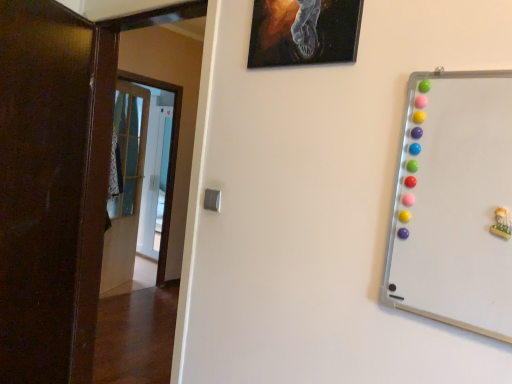
In order to face brown wooden door at left, which is the 2th door from front to back, should I rotate leftwards or rightwards?

It's best to rotate left around 16.453 degrees.

The height and width of the screenshot is (384, 512). Describe the element at coordinates (304, 32) in the screenshot. I see `black canvas painting at upper center` at that location.

The width and height of the screenshot is (512, 384). What do you see at coordinates (454, 203) in the screenshot?
I see `whiteboard at right` at bounding box center [454, 203].

The width and height of the screenshot is (512, 384). In order to click on dark wood door at left, which is counted as the first door, starting from the front in this screenshot , I will do `click(40, 184)`.

Image resolution: width=512 pixels, height=384 pixels. Describe the element at coordinates (125, 183) in the screenshot. I see `wooden door at left, the 1th door in the back-to-front sequence` at that location.

Where is `brown wooden door at left, which is the 2th door from front to back`? brown wooden door at left, which is the 2th door from front to back is located at coordinates (106, 158).

Are brown wooden door at left, which is the 2th door from front to back, and black canvas painting at upper center making contact?

There is a gap between brown wooden door at left, which is the 2th door from front to back, and black canvas painting at upper center.

Could you measure the distance between brown wooden door at left, acting as the 2th door starting from the back, and black canvas painting at upper center?

The distance of brown wooden door at left, acting as the 2th door starting from the back, from black canvas painting at upper center is 83.76 centimeters.

Is black canvas painting at upper center at the back of brown wooden door at left, which is the 2th door from front to back?

No, brown wooden door at left, which is the 2th door from front to back, is not facing the opposite direction of black canvas painting at upper center.

From a real-world perspective, is brown wooden door at left, which is the 2th door from front to back, on black canvas painting at upper center?

No, from a real-world perspective, brown wooden door at left, which is the 2th door from front to back, is not on top of black canvas painting at upper center.

How distant is black canvas painting at upper center from whiteboard at right?

18.38 inches.

Does point (302, 60) come farther from viewer compared to point (469, 144)?

Yes.

From the image's perspective, between black canvas painting at upper center and whiteboard at right, who is located below?

whiteboard at right.

Is black canvas painting at upper center positioned far away from whiteboard at right?

Actually, black canvas painting at upper center and whiteboard at right are a little close together.

How distant is whiteboard at right from transparent glass door at center?

3.58 meters.

Can you confirm if whiteboard at right is shorter than transparent glass door at center?

Indeed, whiteboard at right has a lesser height compared to transparent glass door at center.

Considering the positions of point (492, 92) and point (151, 158), is point (492, 92) closer or farther from the camera than point (151, 158)?

Clearly, point (492, 92) is closer to the camera than point (151, 158).

Based on the photo, from the image's perspective, which is above, whiteboard at right or transparent glass door at center?

transparent glass door at center.

Which of these two, brown wooden door at left, acting as the 2th door starting from the back, or transparent glass door at center, stands taller?

Standing taller between the two is brown wooden door at left, acting as the 2th door starting from the back.

Is brown wooden door at left, which is the 2th door from front to back, far from transparent glass door at center?

Absolutely, brown wooden door at left, which is the 2th door from front to back, is distant from transparent glass door at center.

Is brown wooden door at left, which is the 2th door from front to back, in front of transparent glass door at center?

Yes, it is in front of transparent glass door at center.

From the image's perspective, is brown wooden door at left, which is the 2th door from front to back, on transparent glass door at center?

No, from the image's perspective, brown wooden door at left, which is the 2th door from front to back, is not on top of transparent glass door at center.

From a real-world perspective, which object stands above the other?

From a 3D spatial view, dark wood door at left, which is counted as the first door, starting from the front, is above.

In terms of height, does wooden door at left, the 1th door in the back-to-front sequence, look taller or shorter compared to dark wood door at left, which is counted as the first door, starting from the front?

Clearly, wooden door at left, the 1th door in the back-to-front sequence, is taller compared to dark wood door at left, which is counted as the first door, starting from the front.

Is point (145, 101) positioned after point (4, 24)?

Yes, it is behind point (4, 24).

Based on the photo, is wooden door at left, the 1th door in the back-to-front sequence, inside or outside of dark wood door at left, the third door positioned from the back?

wooden door at left, the 1th door in the back-to-front sequence, is outside dark wood door at left, the third door positioned from the back.

Which is less distant, (426, 120) or (76, 114)?

Clearly, point (426, 120) is closer to the camera than point (76, 114).

From the image's perspective, does whiteboard at right appear higher than dark wood door at left, which is counted as the first door, starting from the front?

Indeed, from the image's perspective, whiteboard at right is shown above dark wood door at left, which is counted as the first door, starting from the front.

Between whiteboard at right and dark wood door at left, the third door positioned from the back, which one has more height?

With more height is dark wood door at left, the third door positioned from the back.

Which object is positioned more to the right, whiteboard at right or dark wood door at left, the third door positioned from the back?

whiteboard at right.

Which object is positioned more to the right, whiteboard at right or black canvas painting at upper center?

whiteboard at right.

From a real-world perspective, does whiteboard at right stand above black canvas painting at upper center?

Actually, whiteboard at right is physically below black canvas painting at upper center in the real world.

Is there a large distance between whiteboard at right and black canvas painting at upper center?

No.

Is whiteboard at right situated inside black canvas painting at upper center or outside?

whiteboard at right is not enclosed by black canvas painting at upper center.

Image resolution: width=512 pixels, height=384 pixels. Find the location of `picture frame positioned vertically above the brown wooden door at left, acting as the 2th door starting from the back (from a real-world perspective)`. picture frame positioned vertically above the brown wooden door at left, acting as the 2th door starting from the back (from a real-world perspective) is located at coordinates (304, 32).

Locate an element on the screen. whiteboard on the right of black canvas painting at upper center is located at coordinates (454, 203).

Which object lies further to the anchor point brown wooden door at left, which is the 2th door from front to back, black canvas painting at upper center or whiteboard at right?

whiteboard at right is further to brown wooden door at left, which is the 2th door from front to back.

From the image, which object appears to be nearer to transparent glass door at center, wooden door at left, the 1th door in the back-to-front sequence, or whiteboard at right?

wooden door at left, the 1th door in the back-to-front sequence, is positioned closer to the anchor transparent glass door at center.

In the scene shown: When comparing their distances from dark wood door at left, which is counted as the first door, starting from the front, does black canvas painting at upper center or wooden door at left, the 1th door in the back-to-front sequence, seem closer?

The object closer to dark wood door at left, which is counted as the first door, starting from the front, is black canvas painting at upper center.

Estimate the real-world distances between objects in this image. Which object is closer to brown wooden door at left, acting as the 2th door starting from the back, whiteboard at right or dark wood door at left, which is counted as the first door, starting from the front?

dark wood door at left, which is counted as the first door, starting from the front, is positioned closer to the anchor brown wooden door at left, acting as the 2th door starting from the back.

When comparing their distances from whiteboard at right, does transparent glass door at center or dark wood door at left, the third door positioned from the back, seem further?

transparent glass door at center is further to whiteboard at right.

When comparing their distances from brown wooden door at left, which is the 2th door from front to back, does dark wood door at left, the third door positioned from the back, or whiteboard at right seem further?

whiteboard at right is further to brown wooden door at left, which is the 2th door from front to back.

Estimate the real-world distances between objects in this image. Which object is closer to dark wood door at left, which is counted as the first door, starting from the front, transparent glass door at center or whiteboard at right?

Based on the image, whiteboard at right appears to be nearer to dark wood door at left, which is counted as the first door, starting from the front.

Which object lies nearer to the anchor point whiteboard at right, wooden door at left, which appears as the 3th door when viewed from the front, or black canvas painting at upper center?

black canvas painting at upper center lies closer to whiteboard at right than the other object.

This screenshot has width=512, height=384. I want to click on picture frame between whiteboard at right and wooden door at left, which appears as the 3th door when viewed from the front, from front to back, so click(x=304, y=32).

I want to click on door between dark wood door at left, the third door positioned from the back, and whiteboard at right, so click(x=106, y=158).

Where is `picture frame between brown wooden door at left, which is the 2th door from front to back, and whiteboard at right`? The width and height of the screenshot is (512, 384). picture frame between brown wooden door at left, which is the 2th door from front to back, and whiteboard at right is located at coordinates (304, 32).

Identify the location of picture frame between whiteboard at right and transparent glass door at center along the z-axis. (304, 32).